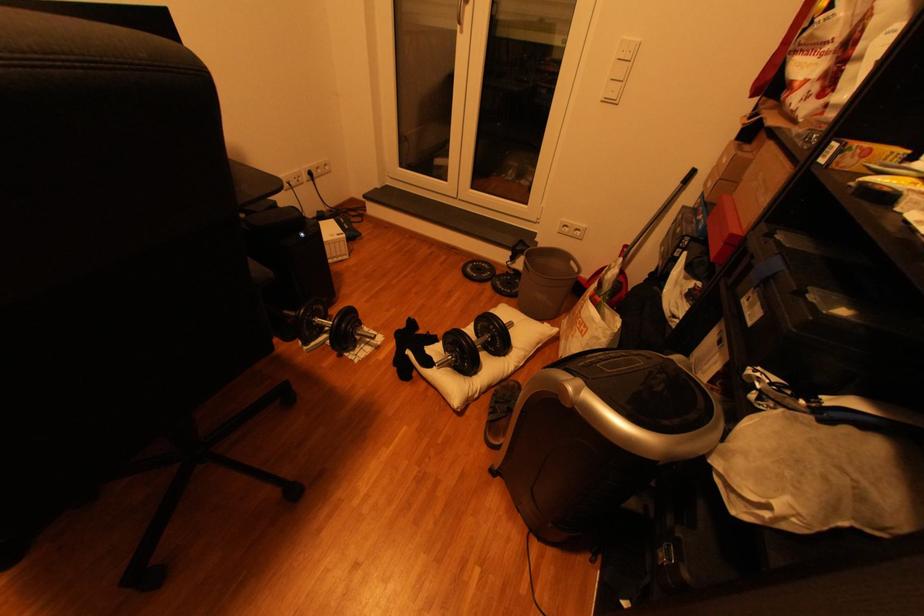
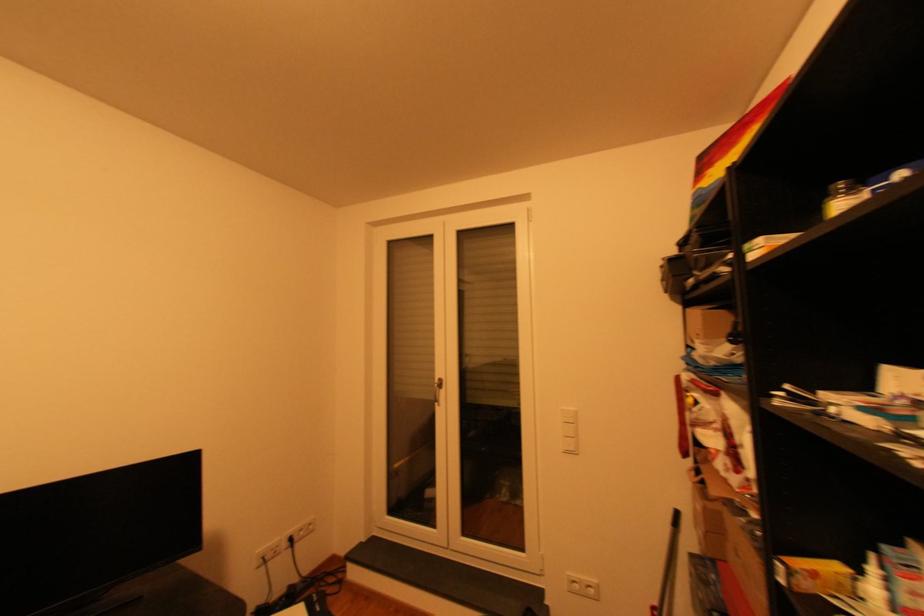
Where in the second image is the point corresponding to (636,246) from the first image?

(662, 608)